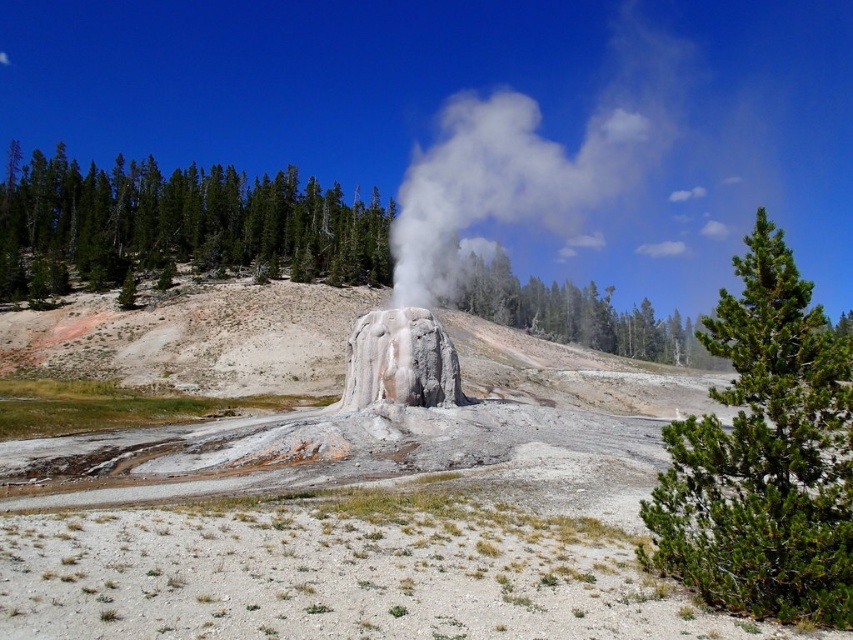
Question: Is the position of green needle-like tree at right more distant than that of green textured pine trees at upper left?

Choices:
 (A) yes
 (B) no

Answer: (B)

Question: Which object is positioned farthest from the gray stone geyser at center?

Choices:
 (A) green textured rock at center
 (B) green needle-like tree at right
 (C) green textured pine trees at upper left

Answer: (C)

Question: Can you confirm if green needle-like tree at right is smaller than gray stone geyser at center?

Choices:
 (A) no
 (B) yes

Answer: (A)

Question: Estimate the real-world distances between objects in this image. Which object is farther from the green needle-like tree at right?

Choices:
 (A) gray stone geyser at center
 (B) green textured rock at center

Answer: (B)

Question: Does green textured rock at center appear under gray stone geyser at center?

Choices:
 (A) yes
 (B) no

Answer: (B)

Question: Which point is farther from the camera taking this photo?

Choices:
 (A) (360, 369)
 (B) (770, 388)

Answer: (A)